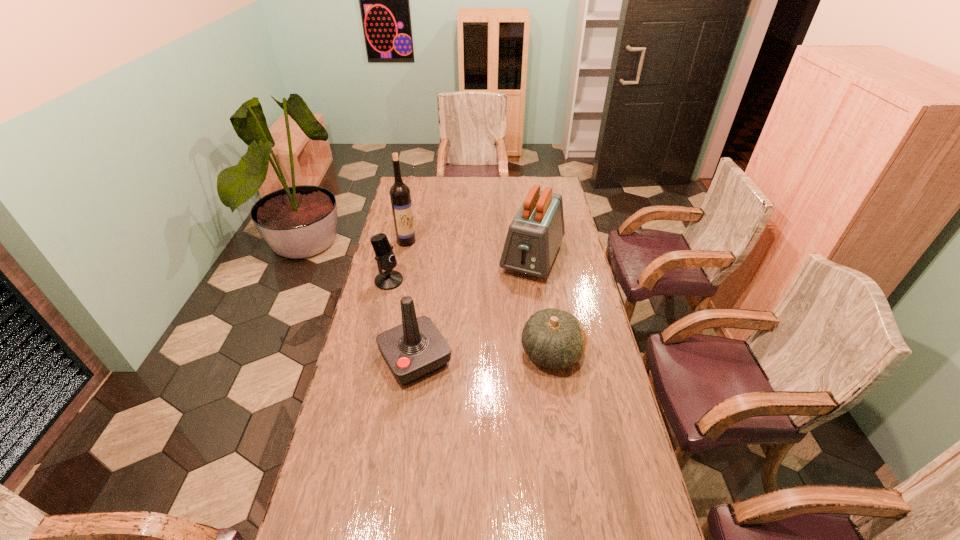
Where is `joystick`? joystick is located at coordinates (416, 348).

Find the location of a particular element. gourd is located at coordinates (552, 338).

Identify the location of the fourth tallest object. This screenshot has height=540, width=960. (389, 279).

You are a GUI agent. You are given a task and a screenshot of the screen. Output one action in this format:
    pyautogui.click(x=<x>, y=<y>)
    Task: Click on the toaster
    This screenshot has width=960, height=540.
    Given the screenshot: What is the action you would take?
    pyautogui.click(x=534, y=236)

The width and height of the screenshot is (960, 540). What are the coordinates of `wine bottle` in the screenshot? It's located at (400, 196).

I want to click on vacant space located 0.310m on the front of the joystick, so click(397, 485).

This screenshot has height=540, width=960. In order to click on free location located on the left of the shortest object in this screenshot , I will do `click(487, 352)`.

You are a GUI agent. You are given a task and a screenshot of the screen. Output one action in this format:
    pyautogui.click(x=<x>, y=<y>)
    Task: Click on the blank space located on the stand of the second shortest object
    This screenshot has width=960, height=540.
    Given the screenshot: What is the action you would take?
    pyautogui.click(x=461, y=333)

At what (x,y) coordinates should I click in order to perform the action: click on free spot located 0.200m on the stand of the second shortest object. Please return your answer as a coordinate pair (x, y). Image resolution: width=960 pixels, height=540 pixels. Looking at the image, I should click on (430, 310).

Locate an element on the screen. This screenshot has height=540, width=960. vacant region located 0.230m on the stand of the second shortest object is located at coordinates (435, 314).